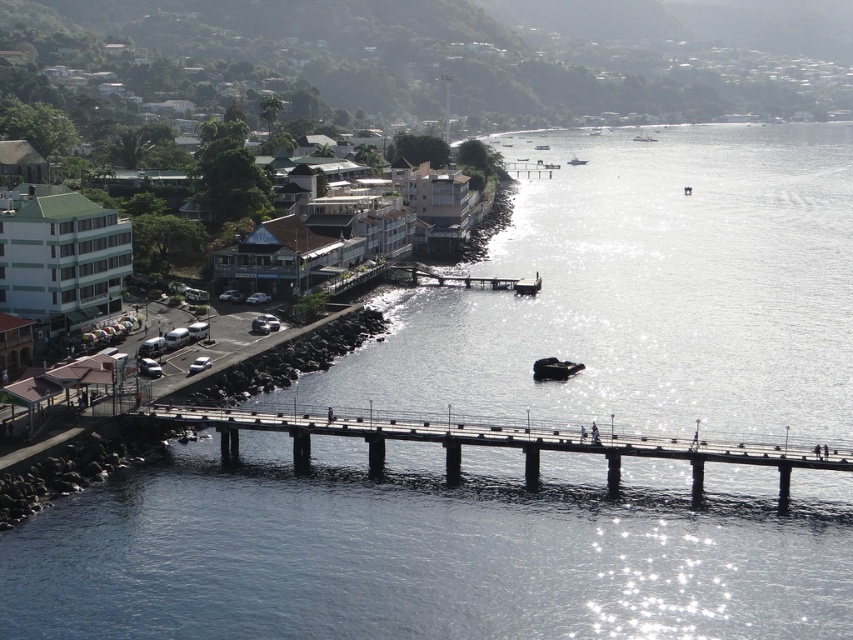
Is smooth concrete bridge at center shorter than dark blue rubber boat at center?

Incorrect, smooth concrete bridge at center's height does not fall short of dark blue rubber boat at center's.

Who is more forward, (x=701, y=492) or (x=573, y=365)?

Point (x=701, y=492) is in front.

Is point (790, 468) positioned behind point (556, 374)?

No, (790, 468) is in front of (556, 374).

In order to click on smooth concrete bridge at center in this screenshot , I will do `click(496, 444)`.

Based on the photo, which is below, dark blue rubber boat at center or white plastic boat at center?

dark blue rubber boat at center is lower down.

Who is shorter, dark blue rubber boat at center or white plastic boat at center?

dark blue rubber boat at center is shorter.

Between point (544, 369) and point (526, 289), which one is positioned behind?

Positioned behind is point (526, 289).

This screenshot has width=853, height=640. Find the location of `dark blue rubber boat at center`. dark blue rubber boat at center is located at coordinates (554, 369).

Does white plastic boat at center appear over metallic gray boat at center?

No.

Is white plastic boat at center behind metallic gray boat at center?

No, it is in front of metallic gray boat at center.

Identify the location of white plastic boat at center. (527, 285).